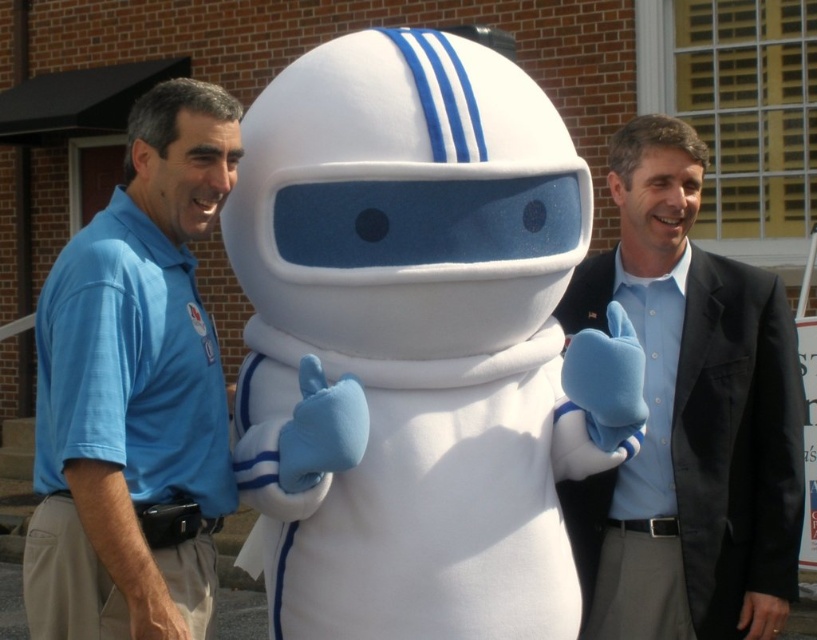
Is blue cotton shirt at left in front of light blue shirt at right?

That is True.

Is blue cotton shirt at left positioned at the back of light blue shirt at right?

No, blue cotton shirt at left is closer to the viewer.

This screenshot has height=640, width=817. What are the coordinates of `blue cotton shirt at left` in the screenshot? It's located at (134, 392).